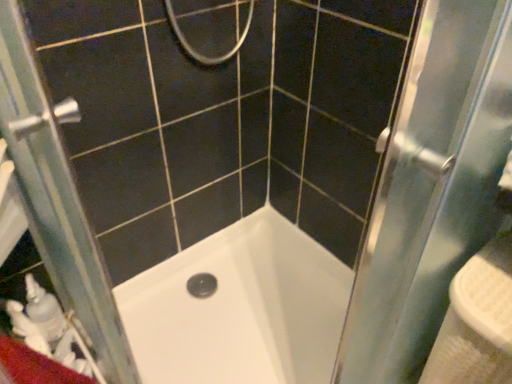
Question: In the image, is clear glass screen door at left positioned in front of or behind white glossy bathtub at center?

Choices:
 (A) behind
 (B) front

Answer: (B)

Question: Looking at their shapes, would you say clear glass screen door at left is wider or thinner than white glossy bathtub at center?

Choices:
 (A) thin
 (B) wide

Answer: (A)

Question: Estimate the real-world distances between objects in this image. Which object is closer to the white plastic sink at right?

Choices:
 (A) white glossy bathtub at center
 (B) clear glass screen door at left

Answer: (A)

Question: Which object is positioned closest to the white plastic sink at right?

Choices:
 (A) clear glass screen door at left
 (B) white glossy bathtub at center

Answer: (B)